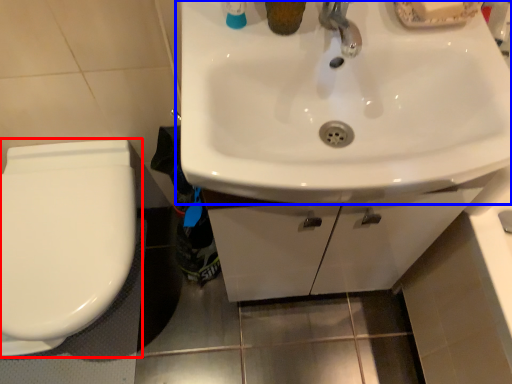
Question: Which object appears closest to the camera in this image, toilet (highlighted by a red box) or sink (highlighted by a blue box)?

Choices:
 (A) toilet
 (B) sink

Answer: (B)